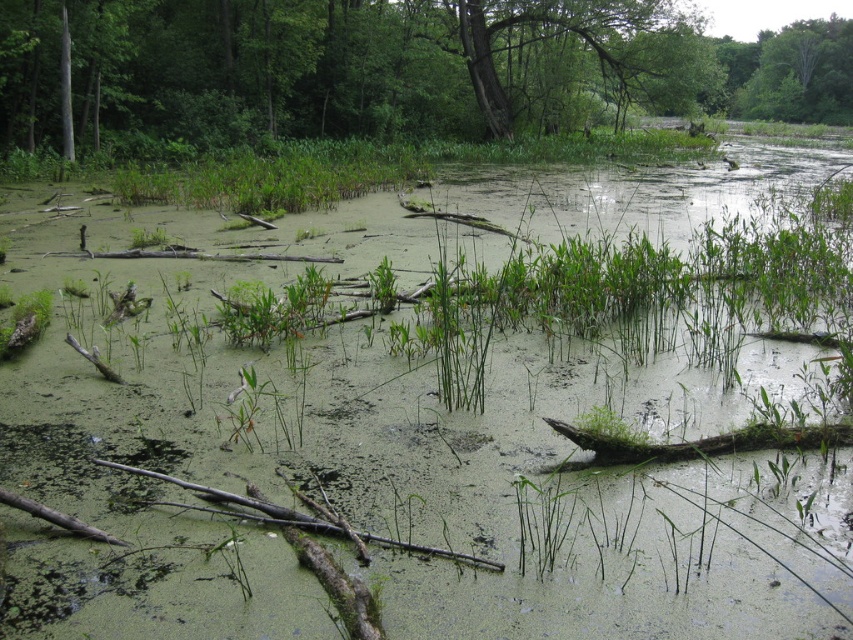
Between smooth bark tree at center and green rough bark tree at upper center, which one appears on the left side from the viewer's perspective?

From the viewer's perspective, green rough bark tree at upper center appears more on the left side.

Is smooth bark tree at center bigger than green rough bark tree at upper center?

Correct, smooth bark tree at center is larger in size than green rough bark tree at upper center.

Between point (93, 70) and point (503, 109), which one is positioned in front?

Point (93, 70) is in front.

Locate an element on the screen. The width and height of the screenshot is (853, 640). smooth bark tree at center is located at coordinates (392, 68).